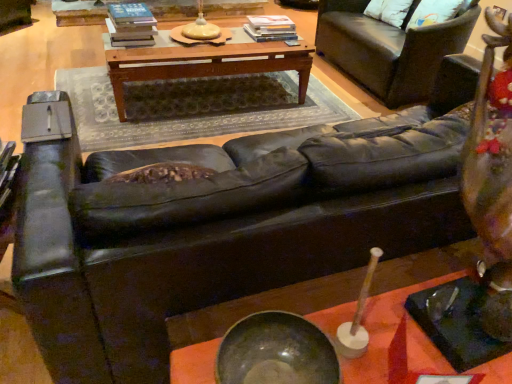
Identify the location of vacant location below woodenobject at center, the first table in the top-to-bottom sequence (from a real-world perspective). The width and height of the screenshot is (512, 384). (202, 103).